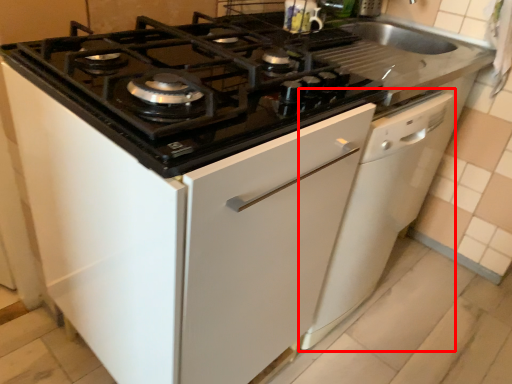
Question: From the image's perspective, where is dish washer (annotated by the red box) located relative to gas stove?

Choices:
 (A) below
 (B) above

Answer: (A)